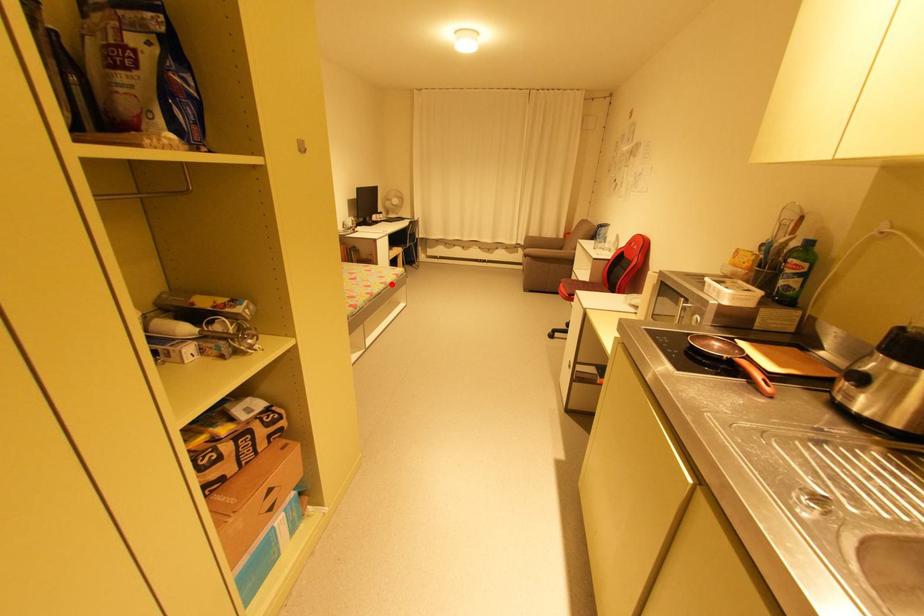
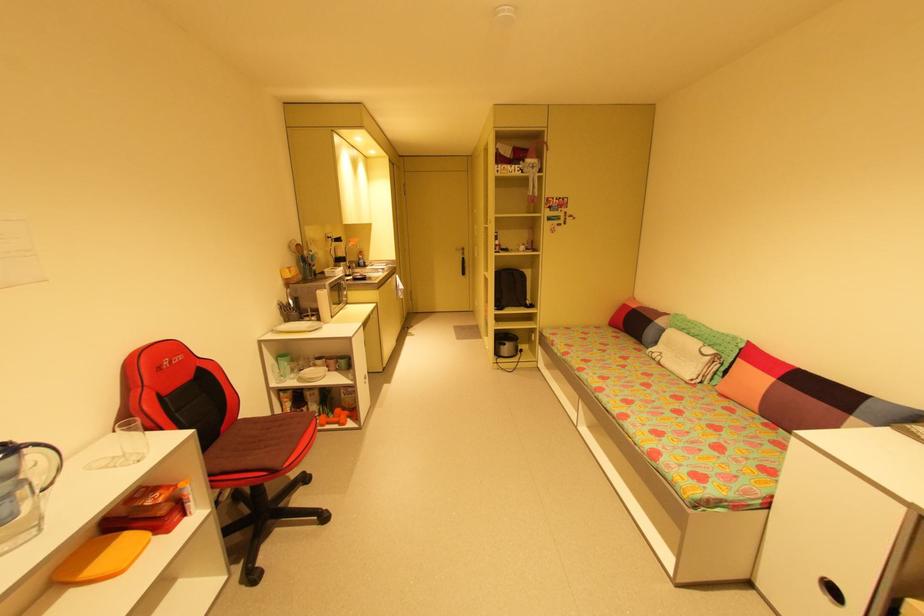
Question: I am providing you with two images of the same scene from different viewpoints. In image1, a red point is highlighted. Considering the same 3D point in image2, which of the following is correct?

Choices:
 (A) It is closer
 (B) It is farther

Answer: (B)